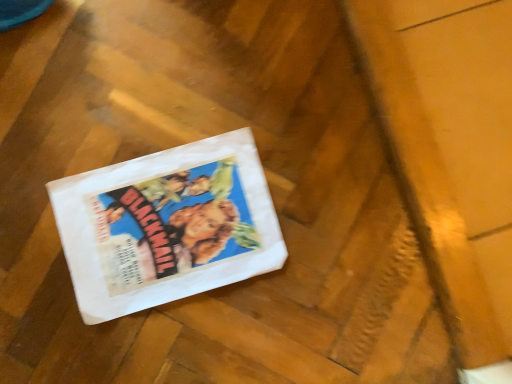
You are a GUI agent. You are given a task and a screenshot of the screen. Output one action in this format:
    pyautogui.click(x=<x>, y=<y>)
    Task: Click on the white paperboard at center
    
    Given the screenshot: What is the action you would take?
    pyautogui.click(x=167, y=226)

This screenshot has width=512, height=384. What do you see at coordinates (167, 226) in the screenshot? I see `white paperboard at center` at bounding box center [167, 226].

Where is `white paperboard at center`? white paperboard at center is located at coordinates (167, 226).